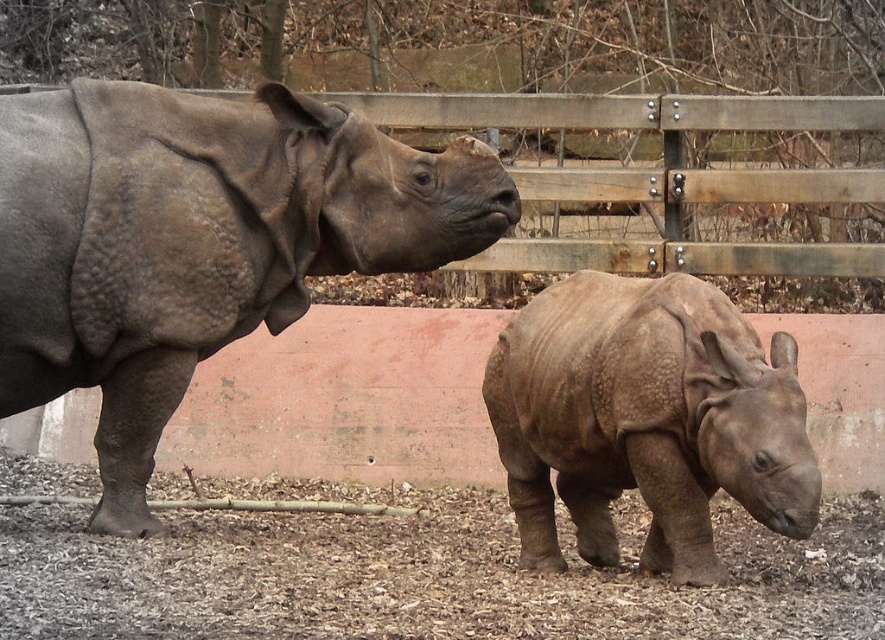
Between gray textured rhino at left and matte gray rhino at center, which one appears on the right side from the viewer's perspective?

Positioned to the right is matte gray rhino at center.

Is point (236, 148) positioned before point (520, 499)?

That is True.

At what (x,y) coordinates should I click in order to perform the action: click on gray textured rhino at left. Please return your answer as a coordinate pair (x, y). Looking at the image, I should click on (198, 241).